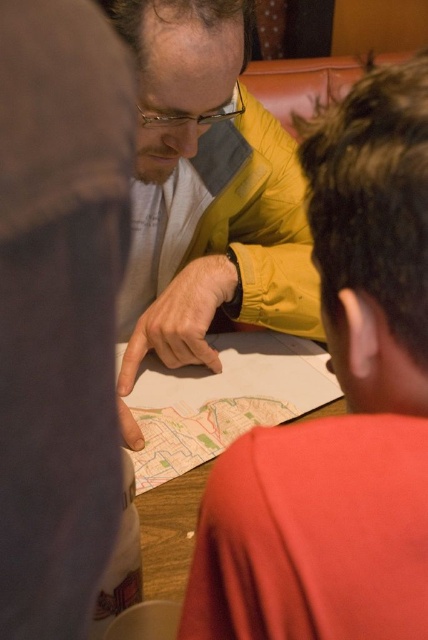
Does matte yellow jacket at upper center appear over white cotton shirt at center?

No.

Image resolution: width=428 pixels, height=640 pixels. What are the coordinates of `matte yellow jacket at upper center` in the screenshot? It's located at (x=347, y=406).

Who is more forward, (253, 541) or (127, 308)?

Point (253, 541) is in front.

Where is `matte yellow jacket at upper center`? Image resolution: width=428 pixels, height=640 pixels. matte yellow jacket at upper center is located at coordinates (347, 406).

Between yellow matte jacket at center and white cotton shirt at center, which one appears on the right side from the viewer's perspective?

Positioned to the right is yellow matte jacket at center.

Can you confirm if yellow matte jacket at center is positioned to the left of white cotton shirt at center?

No, yellow matte jacket at center is not to the left of white cotton shirt at center.

You are a GUI agent. You are given a task and a screenshot of the screen. Output one action in this format:
    pyautogui.click(x=<x>, y=<y>)
    Task: Click on the yellow matte jacket at center
    The image size is (428, 640).
    Given the screenshot: What is the action you would take?
    pyautogui.click(x=208, y=192)

Looking at this image, can you confirm if wooden table at center is bigger than white cotton shirt at center?

Correct, wooden table at center is larger in size than white cotton shirt at center.

Does wooden table at center have a lesser height compared to white cotton shirt at center?

Yes, wooden table at center is shorter than white cotton shirt at center.

Image resolution: width=428 pixels, height=640 pixels. I want to click on wooden table at center, so [199, 445].